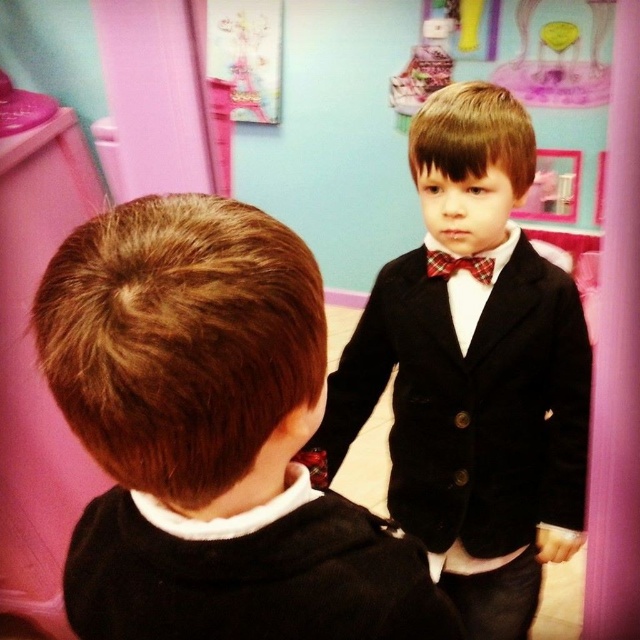
Is black velvet suit at center further to the viewer compared to velvet black suit at center?

No.

This screenshot has width=640, height=640. What do you see at coordinates (211, 436) in the screenshot?
I see `black velvet suit at center` at bounding box center [211, 436].

This screenshot has height=640, width=640. What are the coordinates of `black velvet suit at center` in the screenshot? It's located at (211, 436).

From the picture: Who is lower down, black velvet suit at center or plaid fabric bow tie at center?

black velvet suit at center

This screenshot has height=640, width=640. What do you see at coordinates (211, 436) in the screenshot?
I see `black velvet suit at center` at bounding box center [211, 436].

You are a GUI agent. You are given a task and a screenshot of the screen. Output one action in this format:
    pyautogui.click(x=<x>, y=<y>)
    Task: Click on the black velvet suit at center
    The width and height of the screenshot is (640, 640).
    Given the screenshot: What is the action you would take?
    pyautogui.click(x=211, y=436)

Can you confirm if velvet black suit at center is smaller than plaid fabric bow tie at center?

No.

Can you confirm if velvet black suit at center is bigger than plaid fabric bow tie at center?

Yes.

Which is in front, point (506, 429) or point (492, 275)?

Point (492, 275) is more forward.

At what (x,y) coordinates should I click in order to perform the action: click on velvet black suit at center. Please return your answer as a coordinate pair (x, y). The height and width of the screenshot is (640, 640). Looking at the image, I should click on (474, 371).